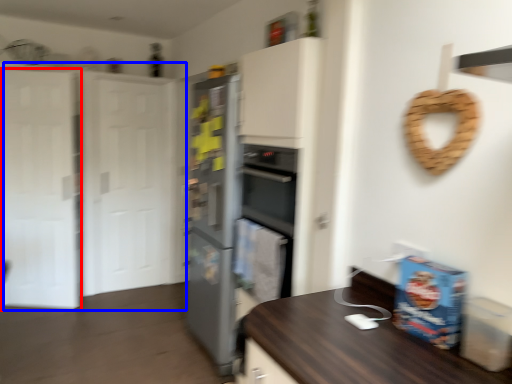
Question: Among these objects, which one is farthest to the camera, glass door (highlighted by a red box) or door (highlighted by a blue box)?

Choices:
 (A) glass door
 (B) door

Answer: (A)